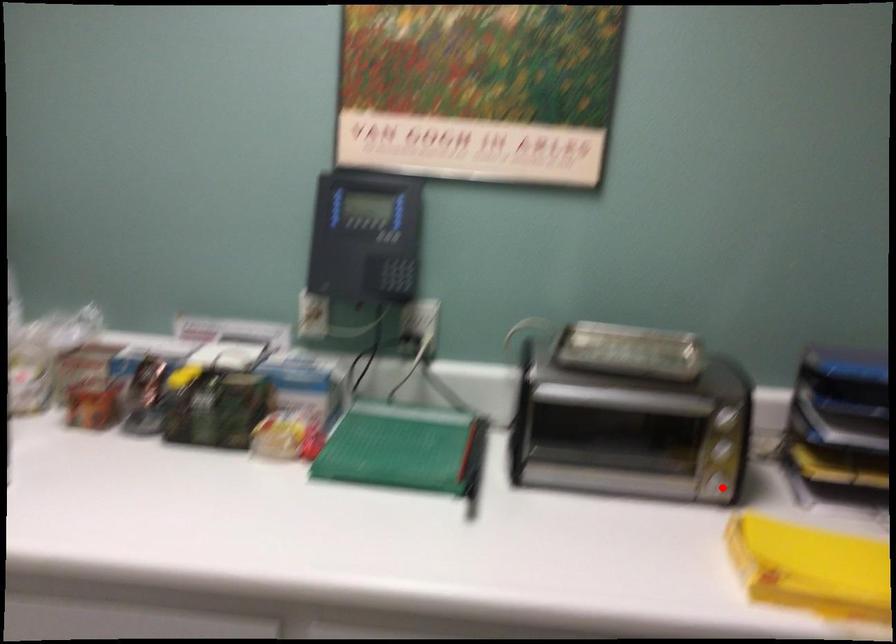
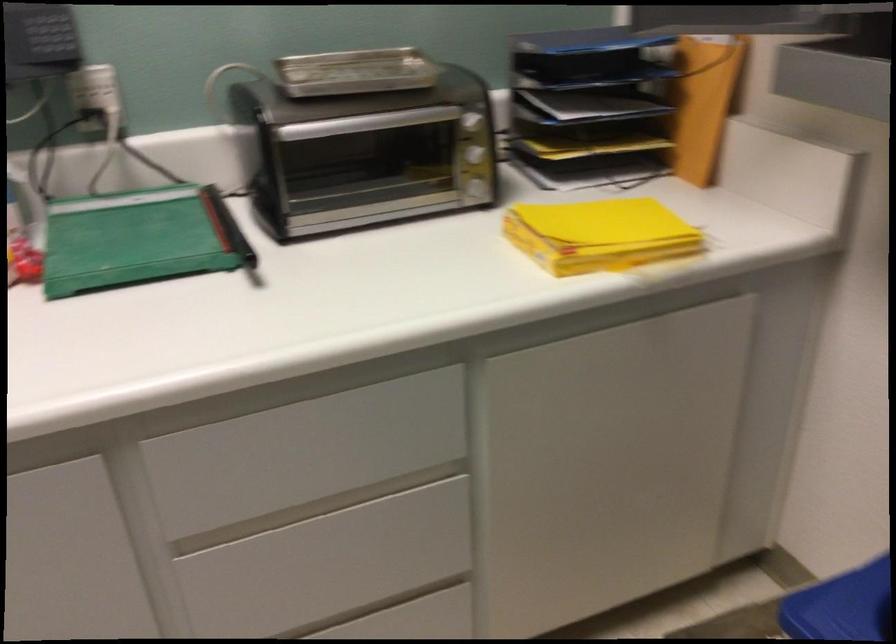
Find the pixel in the second image that matches the highlighted location in the first image.

(478, 190)